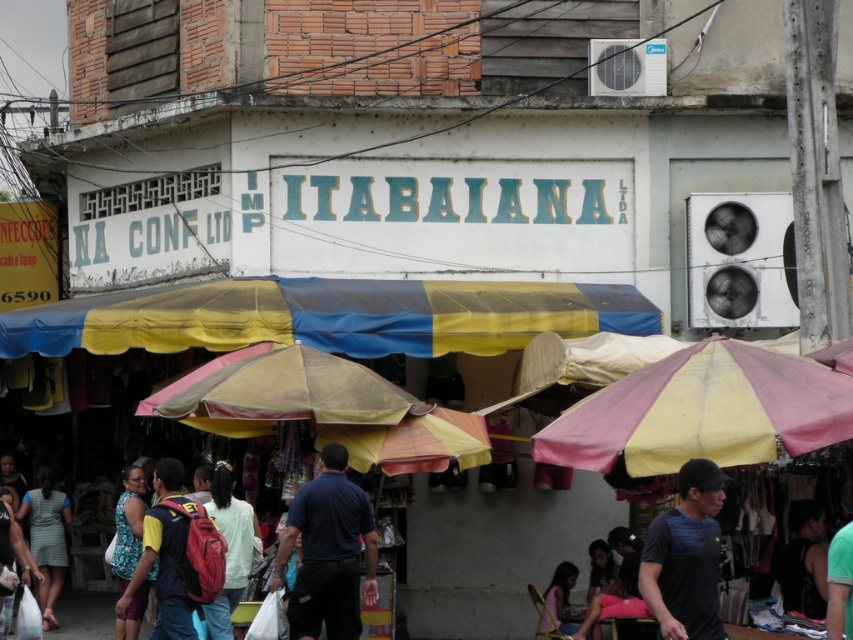
Is dark blue shirt at center above black matte shirt at center?

Incorrect, dark blue shirt at center is not positioned above black matte shirt at center.

Describe the element at coordinates (328, 552) in the screenshot. I see `dark blue shirt at center` at that location.

Image resolution: width=853 pixels, height=640 pixels. I want to click on dark blue shirt at center, so tap(328, 552).

Which is more to the left, beige fabric umbrella at center or dark blue shirt at center?

beige fabric umbrella at center

Which is in front, point (253, 374) or point (352, 628)?

Point (352, 628)

What do you see at coordinates (282, 392) in the screenshot? This screenshot has width=853, height=640. I see `beige fabric umbrella at center` at bounding box center [282, 392].

This screenshot has width=853, height=640. I want to click on beige fabric umbrella at center, so click(x=282, y=392).

Is point (376, 406) positioned behind point (172, 634)?

That is True.

Is beige fabric umbrella at center further to the viewer compared to red backpack at center?

No, beige fabric umbrella at center is closer to the viewer.

Is point (189, 392) behind point (144, 525)?

Yes.

What are the coordinates of `beige fabric umbrella at center` in the screenshot? It's located at (282, 392).